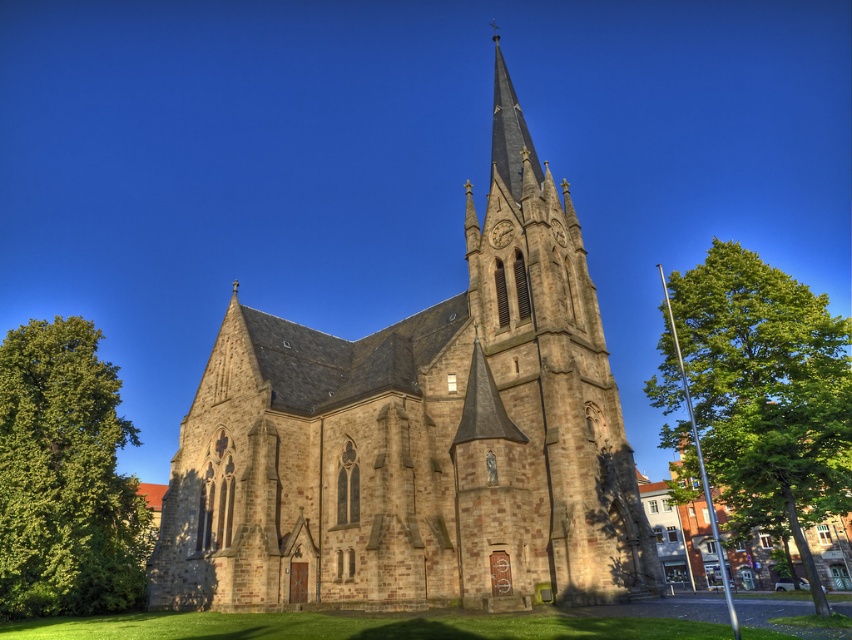
You are standing at the point marked by coordinates point (418, 438). Looking towards the brown stone church at center, which direction should you walk to reach it?

Since the point (418, 438) is the location of the brown stone church at center, you are already at the church.

You are standing in front of the church and want to take a photo that includes both the green leafy tree at right and the green leafy tree at left. Which tree should you position closer to the center of the frame to ensure both are visible without cropping?

You should position the green leafy tree at right closer to the center of the frame because it is smaller than the green leafy tree at left, allowing both to fit within the photo.